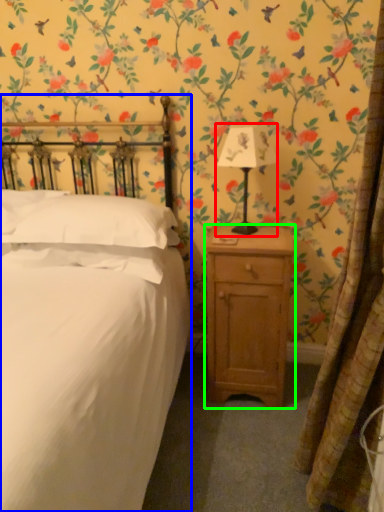
Question: Considering the real-world distances, which object is farthest from bedside lamp (highlighted by a red box)? bed (highlighted by a blue box) or nightstand (highlighted by a green box)?

Choices:
 (A) bed
 (B) nightstand

Answer: (A)